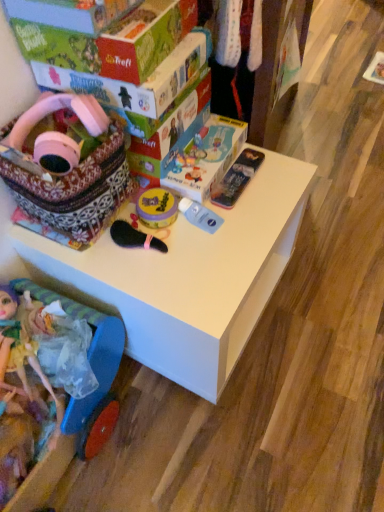
This screenshot has width=384, height=512. Find the location of `pink matte headphones at upper left, which is counted as the fifth toy, starting from the right`. pink matte headphones at upper left, which is counted as the fifth toy, starting from the right is located at coordinates (56, 111).

Measure the distance between point (93, 213) and camera.

They are 33.43 inches apart.

The height and width of the screenshot is (512, 384). What do you see at coordinates (200, 215) in the screenshot? I see `transparent plastic bottle at center, positioned as the fifth toy in left-to-right order` at bounding box center [200, 215].

What is the approximate height of metallic plastic pencil case at upper right, which is the sixth toy from left to right?

metallic plastic pencil case at upper right, which is the sixth toy from left to right, is 1.16 inches in height.

Locate an element on the screen. green cardboard box at upper left, the 1th box in the front-to-back sequence is located at coordinates (112, 41).

The height and width of the screenshot is (512, 384). I want to click on pink matte headphones at upper left, which is counted as the fifth toy, starting from the right, so click(x=56, y=111).

Considering the positions of point (16, 306) and point (96, 133), is point (16, 306) closer or farther from the camera than point (96, 133)?

Clearly, point (16, 306) is more distant from the camera than point (96, 133).

Is plastic doll at lower left, which appears as the first toy when viewed from the left, located outside pink matte headphones at upper left, the second toy viewed from the left?

Yes, plastic doll at lower left, which appears as the first toy when viewed from the left, is outside of pink matte headphones at upper left, the second toy viewed from the left.

Which of these two, plastic doll at lower left, placed as the sixth toy when sorted from right to left, or pink matte headphones at upper left, the second toy viewed from the left, stands taller?

Standing taller between the two is plastic doll at lower left, placed as the sixth toy when sorted from right to left.

Is transparent plastic bottle at center, positioned as the fifth toy in left-to-right order, completely or partially inside pink matte headphones at upper left, the second toy viewed from the left?

No.

How distant is pink matte headphones at upper left, which is counted as the fifth toy, starting from the right, from transparent plastic bottle at center, positioned as the fifth toy in left-to-right order?

pink matte headphones at upper left, which is counted as the fifth toy, starting from the right, and transparent plastic bottle at center, positioned as the fifth toy in left-to-right order, are 12.80 inches apart from each other.

Looking at this image, which is more to the right, pink matte headphones at upper left, the second toy viewed from the left, or transparent plastic bottle at center, positioned as the fifth toy in left-to-right order?

transparent plastic bottle at center, positioned as the fifth toy in left-to-right order, is more to the right.

From a real-world perspective, is pink matte headphones at upper left, the second toy viewed from the left, on transparent plastic bottle at center, which is the second toy from right to left?

Yes.

Considering the positions of objects metallic plastic pencil case at upper right, which is the sixth toy from left to right, and green cardboard box at upper left, the 1th box in the front-to-back sequence, in the image provided, who is more to the left, metallic plastic pencil case at upper right, which is the sixth toy from left to right, or green cardboard box at upper left, the 1th box in the front-to-back sequence,?

Positioned to the left is green cardboard box at upper left, the 1th box in the front-to-back sequence.

From a real-world perspective, is metallic plastic pencil case at upper right, which is the sixth toy from left to right, under green cardboard box at upper left, which ranks as the 2th box in back-to-front order?

Yes, from a real-world perspective, metallic plastic pencil case at upper right, which is the sixth toy from left to right, is under green cardboard box at upper left, which ranks as the 2th box in back-to-front order.

Does metallic plastic pencil case at upper right, which is the sixth toy from left to right, have a smaller size compared to green cardboard box at upper left, which ranks as the 2th box in back-to-front order?

Correct, metallic plastic pencil case at upper right, which is the sixth toy from left to right, occupies less space than green cardboard box at upper left, which ranks as the 2th box in back-to-front order.

Is metallic plastic pencil case at upper right, which is the sixth toy from left to right, inside the boundaries of green cardboard box at upper left, which ranks as the 2th box in back-to-front order, or outside?

metallic plastic pencil case at upper right, which is the sixth toy from left to right, lies outside green cardboard box at upper left, which ranks as the 2th box in back-to-front order.

Which is nearer, (x=18, y=305) or (x=203, y=218)?

Positioned in front is point (x=18, y=305).

Considering the relative sizes of plastic doll at lower left, placed as the sixth toy when sorted from right to left, and transparent plastic bottle at center, positioned as the fifth toy in left-to-right order, in the image provided, is plastic doll at lower left, placed as the sixth toy when sorted from right to left, shorter than transparent plastic bottle at center, positioned as the fifth toy in left-to-right order,?

No, plastic doll at lower left, placed as the sixth toy when sorted from right to left, is not shorter than transparent plastic bottle at center, positioned as the fifth toy in left-to-right order.

From a real-world perspective, which is physically above, plastic doll at lower left, which appears as the first toy when viewed from the left, or transparent plastic bottle at center, which is the second toy from right to left?

In real-world perspective, transparent plastic bottle at center, which is the second toy from right to left, is above.

Based on the photo, which of these two, metallic plastic pencil case at upper right, which is the sixth toy from left to right, or patterned fabric basket at upper left, placed as the 3th toy when sorted from left to right, is wider?

Wider between the two is patterned fabric basket at upper left, placed as the 3th toy when sorted from left to right.

From a real-world perspective, count 3rd toys downward from the patterned fabric basket at upper left, which is the 4th toy from right to left, and point to it. Please provide its 2D coordinates.

[(237, 178)]

Does point (220, 194) come closer to viewer compared to point (75, 108)?

No, (220, 194) is behind (75, 108).

Between metallic plastic pencil case at upper right, which is the sixth toy from left to right, and patterned fabric basket at upper left, placed as the 3th toy when sorted from left to right, which one has more height?

Standing taller between the two is patterned fabric basket at upper left, placed as the 3th toy when sorted from left to right.

Is pink matte headphones at upper left, which is counted as the fifth toy, starting from the right, thinner than yellow matte jar at center, positioned as the 3th toy in right-to-left order?

In fact, pink matte headphones at upper left, which is counted as the fifth toy, starting from the right, might be wider than yellow matte jar at center, positioned as the 3th toy in right-to-left order.

Is the surface of pink matte headphones at upper left, which is counted as the fifth toy, starting from the right, in direct contact with yellow matte jar at center, positioned as the 3th toy in right-to-left order?

pink matte headphones at upper left, which is counted as the fifth toy, starting from the right, is not next to yellow matte jar at center, positioned as the 3th toy in right-to-left order, and they're not touching.

In the scene shown: Is the depth of pink matte headphones at upper left, which is counted as the fifth toy, starting from the right, greater than that of yellow matte jar at center, positioned as the 3th toy in right-to-left order?

No, pink matte headphones at upper left, which is counted as the fifth toy, starting from the right, is closer to the camera.

Which is behind, point (108, 127) or point (142, 221)?

Point (142, 221)

Which of these two, transparent plastic bottle at center, which is the second toy from right to left, or white matte table at center, is bigger?

white matte table at center is bigger.

Can you confirm if transparent plastic bottle at center, which is the second toy from right to left, is thinner than white matte table at center?

Indeed, transparent plastic bottle at center, which is the second toy from right to left, has a lesser width compared to white matte table at center.

From the image's perspective, is transparent plastic bottle at center, which is the second toy from right to left, beneath white matte table at center?

Actually, transparent plastic bottle at center, which is the second toy from right to left, appears above white matte table at center in the image.

Is white matte table at center inside transparent plastic bottle at center, positioned as the fifth toy in left-to-right order?

No, white matte table at center is not inside transparent plastic bottle at center, positioned as the fifth toy in left-to-right order.

This screenshot has width=384, height=512. What are the coordinates of `toy that appears on the left of pink matte headphones at upper left, which is counted as the fifth toy, starting from the right` in the screenshot? It's located at (27, 351).

The width and height of the screenshot is (384, 512). In order to click on the 3rd toy positioned above the transparent plastic bottle at center, positioned as the fifth toy in left-to-right order (from a real-world perspective) in this screenshot , I will do `click(56, 111)`.

When comparing their distances from green cardboard box at upper left, which ranks as the 2th box in back-to-front order, does pink matte headphones at upper left, the second toy viewed from the left, or matte cardboard box at upper center, which is counted as the 2th box, starting from the front, seem further?

pink matte headphones at upper left, the second toy viewed from the left.

From the picture: Considering their positions, is plastic doll at lower left, which appears as the first toy when viewed from the left, positioned further to patterned fabric basket at upper left, placed as the 3th toy when sorted from left to right, than transparent plastic bottle at center, which is the second toy from right to left?

The object further to patterned fabric basket at upper left, placed as the 3th toy when sorted from left to right, is plastic doll at lower left, which appears as the first toy when viewed from the left.

Considering their positions, is white matte table at center positioned further to transparent plastic bottle at center, which is the second toy from right to left, than metallic plastic pencil case at upper right, arranged as the 1th toy when viewed from the right?

white matte table at center is positioned further to the anchor transparent plastic bottle at center, which is the second toy from right to left.

When comparing their distances from metallic plastic pencil case at upper right, which is the sixth toy from left to right, does green cardboard box at upper left, which ranks as the 2th box in back-to-front order, or transparent plastic bottle at center, positioned as the fifth toy in left-to-right order, seem further?

The object further to metallic plastic pencil case at upper right, which is the sixth toy from left to right, is green cardboard box at upper left, which ranks as the 2th box in back-to-front order.

Looking at the image, which one is located further to plastic doll at lower left, placed as the sixth toy when sorted from right to left, patterned fabric basket at upper left, placed as the 3th toy when sorted from left to right, or transparent plastic bottle at center, which is the second toy from right to left?

Among the two, transparent plastic bottle at center, which is the second toy from right to left, is located further to plastic doll at lower left, placed as the sixth toy when sorted from right to left.

Considering their positions, is green cardboard box at upper left, which ranks as the 2th box in back-to-front order, positioned further to white matte table at center than yellow matte jar at center, the 4th toy positioned from the left?

green cardboard box at upper left, which ranks as the 2th box in back-to-front order.

Estimate the real-world distances between objects in this image. Which object is closer to metallic plastic pencil case at upper right, which is the sixth toy from left to right, white matte table at center or transparent plastic bottle at center, positioned as the fifth toy in left-to-right order?

Based on the image, transparent plastic bottle at center, positioned as the fifth toy in left-to-right order, appears to be nearer to metallic plastic pencil case at upper right, which is the sixth toy from left to right.

Based on their spatial positions, is transparent plastic bottle at center, which is the second toy from right to left, or patterned fabric basket at upper left, which is the 4th toy from right to left, further from yellow matte jar at center, the 4th toy positioned from the left?

Based on the image, patterned fabric basket at upper left, which is the 4th toy from right to left, appears to be further to yellow matte jar at center, the 4th toy positioned from the left.

I want to click on box between green cardboard box at upper left, the 1th box in the front-to-back sequence, and transparent plastic bottle at center, which is the second toy from right to left, from top to bottom, so click(x=133, y=84).

Find the location of `toy between yellow matte jar at center, the 4th toy positioned from the left, and metallic plastic pencil case at upper right, which is the sixth toy from left to right`. toy between yellow matte jar at center, the 4th toy positioned from the left, and metallic plastic pencil case at upper right, which is the sixth toy from left to right is located at coordinates (200, 215).

Where is `table between pink matte headphones at upper left, the second toy viewed from the left, and plastic doll at lower left, placed as the sixth toy when sorted from right to left, in the vertical direction`? table between pink matte headphones at upper left, the second toy viewed from the left, and plastic doll at lower left, placed as the sixth toy when sorted from right to left, in the vertical direction is located at coordinates (188, 277).

Locate an element on the screen. toy between white matte table at center and yellow matte jar at center, positioned as the 3th toy in right-to-left order, from front to back is located at coordinates (200, 215).